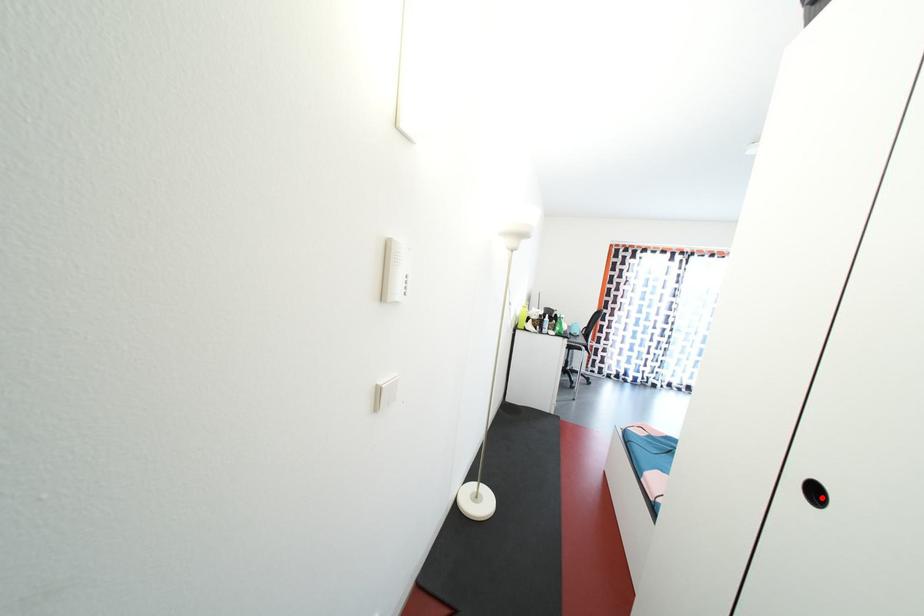
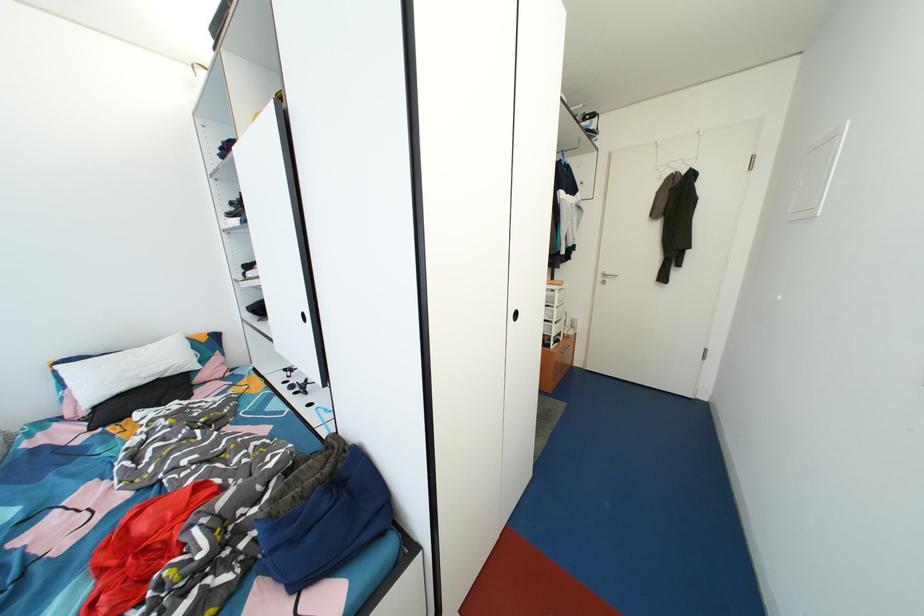
Where in the second image is the point corresponding to the highlighted location from the first image?

(523, 320)